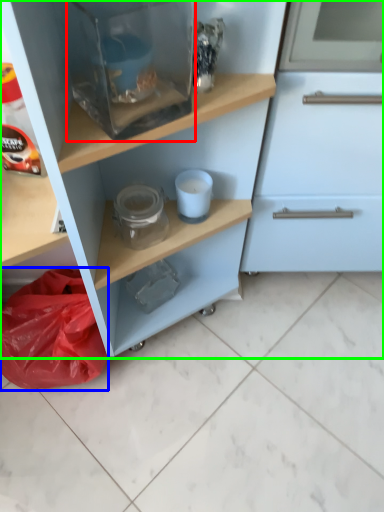
Question: Which object is positioned closest to appliance (highlighted by a red box)? Select from material (highlighted by a blue box) and cupboard (highlighted by a green box).

Choices:
 (A) material
 (B) cupboard

Answer: (B)